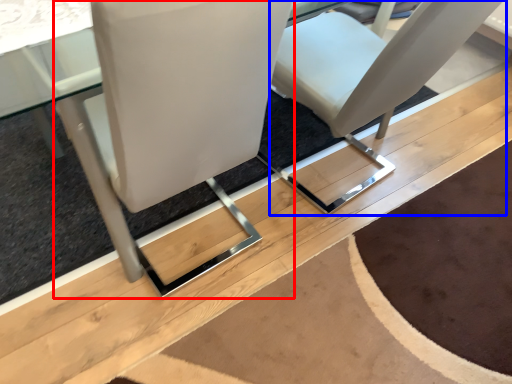
Question: Which object appears farthest to the camera in this image, chair (highlighted by a red box) or chair (highlighted by a blue box)?

Choices:
 (A) chair
 (B) chair

Answer: (B)